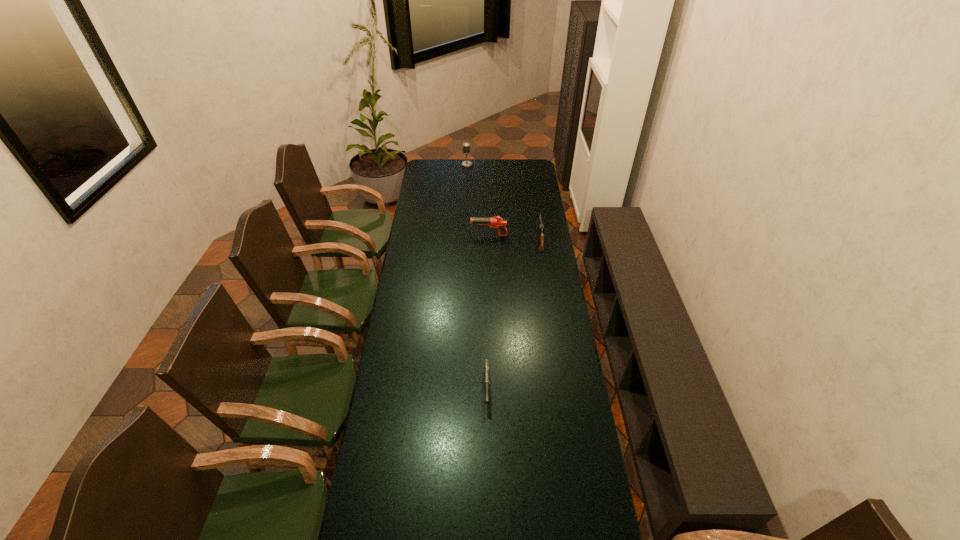
The image size is (960, 540). I want to click on the leftmost object, so click(x=466, y=146).

Locate an element on the screen. This screenshot has height=540, width=960. the farthest object is located at coordinates (466, 146).

The image size is (960, 540). Find the location of `the rightmost gun`. the rightmost gun is located at coordinates (541, 227).

At what (x,y) coordinates should I click in order to perform the action: click on the shortest object. Please return your answer as a coordinate pair (x, y). Looking at the image, I should click on (486, 364).

Image resolution: width=960 pixels, height=540 pixels. Find the location of `the nearest gun`. the nearest gun is located at coordinates (486, 364).

At what (x,y) coordinates should I click in order to perform the action: click on vacant area located 0.170m on the front of the microphone. Please return your answer as a coordinate pair (x, y). The height and width of the screenshot is (540, 960). Looking at the image, I should click on (467, 181).

Locate an element on the screen. This screenshot has height=540, width=960. vacant area situated along the barrel of the rightmost object is located at coordinates pyautogui.click(x=535, y=206).

Find the location of `vacant space situated 0.130m along the barrel of the rightmost object`. vacant space situated 0.130m along the barrel of the rightmost object is located at coordinates (536, 215).

Identify the location of vacant point located along the barrel of the rightmost object. The width and height of the screenshot is (960, 540). (533, 196).

Where is `free space located 0.400m at the muzzle end of the shortest object`? The height and width of the screenshot is (540, 960). free space located 0.400m at the muzzle end of the shortest object is located at coordinates (x=489, y=537).